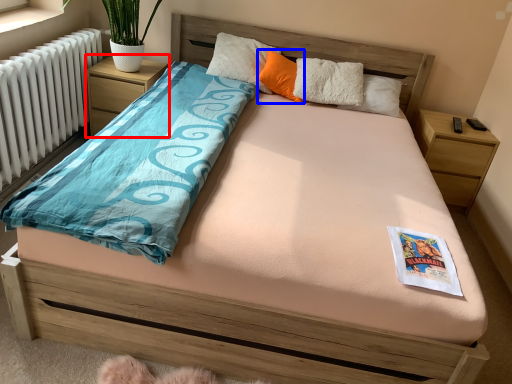
Question: Which point is further to the camera, nightstand (highlighted by a red box) or pillow (highlighted by a blue box)?

Choices:
 (A) nightstand
 (B) pillow

Answer: (A)